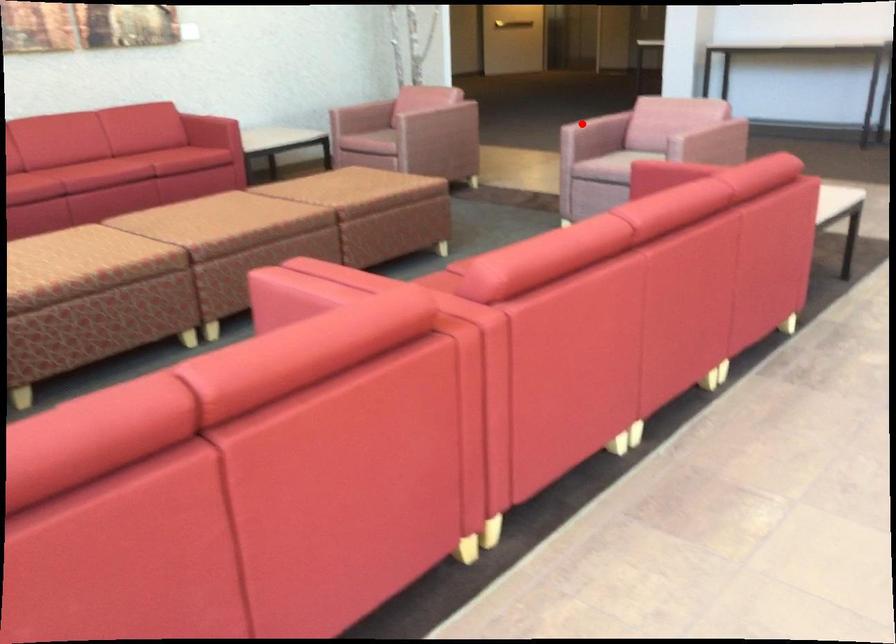
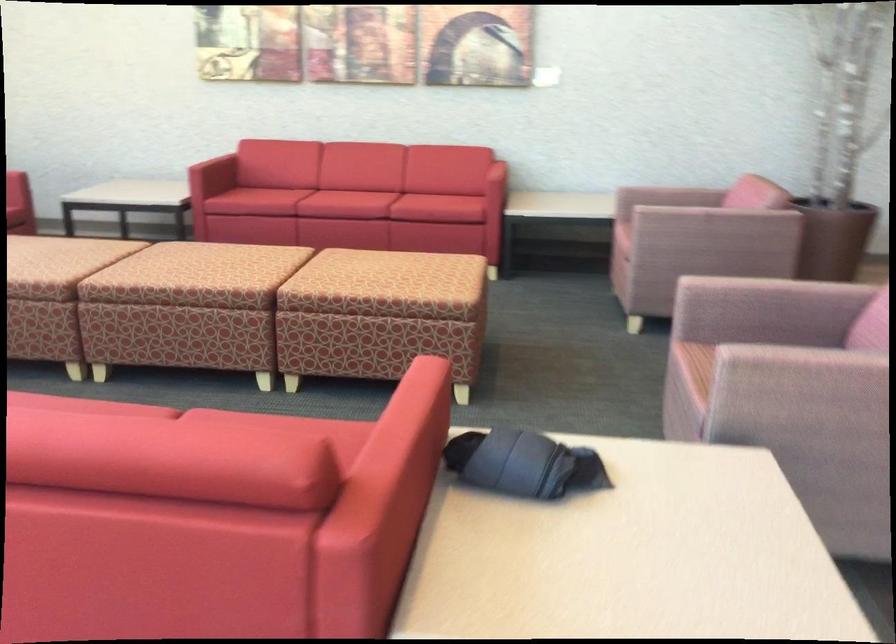
Locate, in the second image, the point that corresponds to the highlighted location in the first image.

(728, 278)